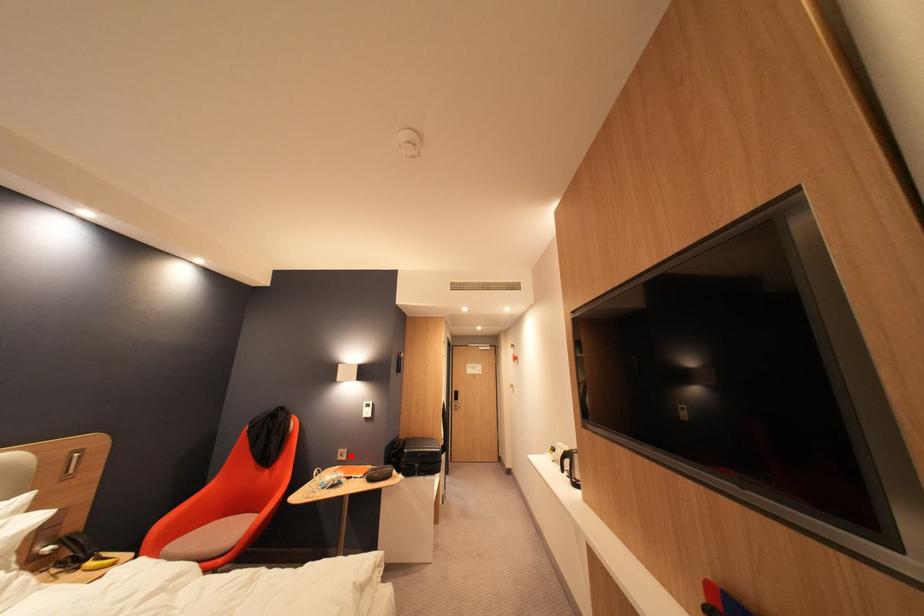
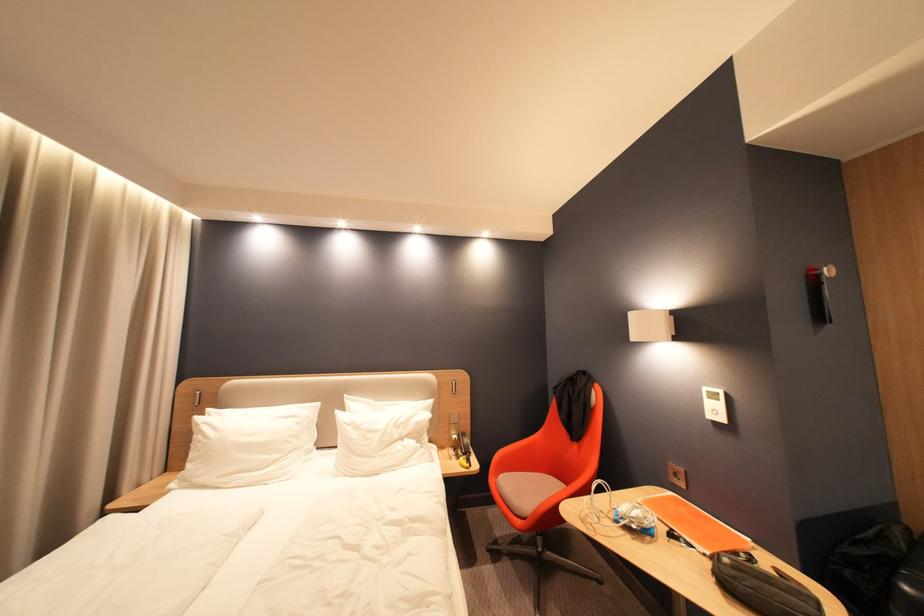
Question: I am providing you with two images of the same scene from different viewpoints. A red point is marked on the first image. Can you still see the location of the red point in image 2?

Choices:
 (A) Yes
 (B) No

Answer: (A)